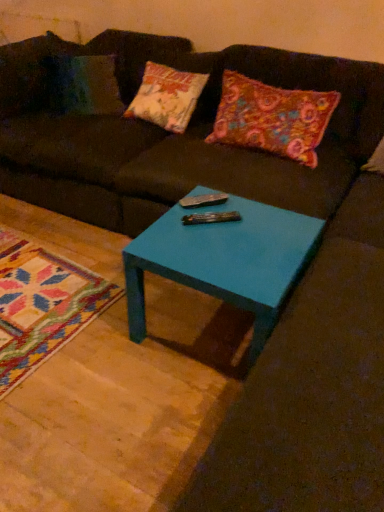
Question: Is multicolored felt pillow at upper right outside teal glossy table at center?

Choices:
 (A) no
 (B) yes

Answer: (B)

Question: Is multicolored felt pillow at upper right in front of teal glossy table at center?

Choices:
 (A) yes
 (B) no

Answer: (B)

Question: From a real-world perspective, is multicolored felt pillow at upper right under teal glossy table at center?

Choices:
 (A) no
 (B) yes

Answer: (A)

Question: Is multicolored felt pillow at upper right wider than teal glossy table at center?

Choices:
 (A) yes
 (B) no

Answer: (B)

Question: Can you confirm if multicolored felt pillow at upper right is shorter than teal glossy table at center?

Choices:
 (A) no
 (B) yes

Answer: (A)

Question: From the image's perspective, is multicolored felt pillow at upper right above teal glossy table at center?

Choices:
 (A) no
 (B) yes

Answer: (B)

Question: Is matte brown couch at center completely or partially outside of metallic silver remote at center?

Choices:
 (A) no
 (B) yes

Answer: (B)

Question: Does matte brown couch at center appear on the left side of metallic silver remote at center?

Choices:
 (A) yes
 (B) no

Answer: (A)

Question: Considering the relative sizes of matte brown couch at center and metallic silver remote at center in the image provided, is matte brown couch at center wider than metallic silver remote at center?

Choices:
 (A) no
 (B) yes

Answer: (B)

Question: Considering the relative sizes of matte brown couch at center and metallic silver remote at center in the image provided, is matte brown couch at center shorter than metallic silver remote at center?

Choices:
 (A) yes
 (B) no

Answer: (B)

Question: Is matte brown couch at center facing towards metallic silver remote at center?

Choices:
 (A) yes
 (B) no

Answer: (A)

Question: Can you confirm if matte brown couch at center is smaller than metallic silver remote at center?

Choices:
 (A) yes
 (B) no

Answer: (B)

Question: Does metallic silver remote at center have a greater width compared to matte brown couch at center?

Choices:
 (A) yes
 (B) no

Answer: (B)